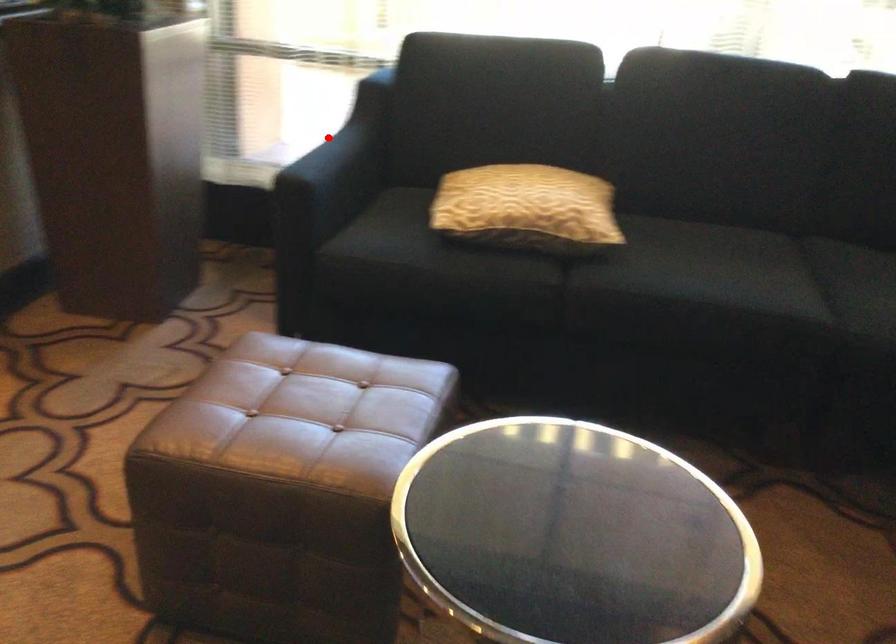
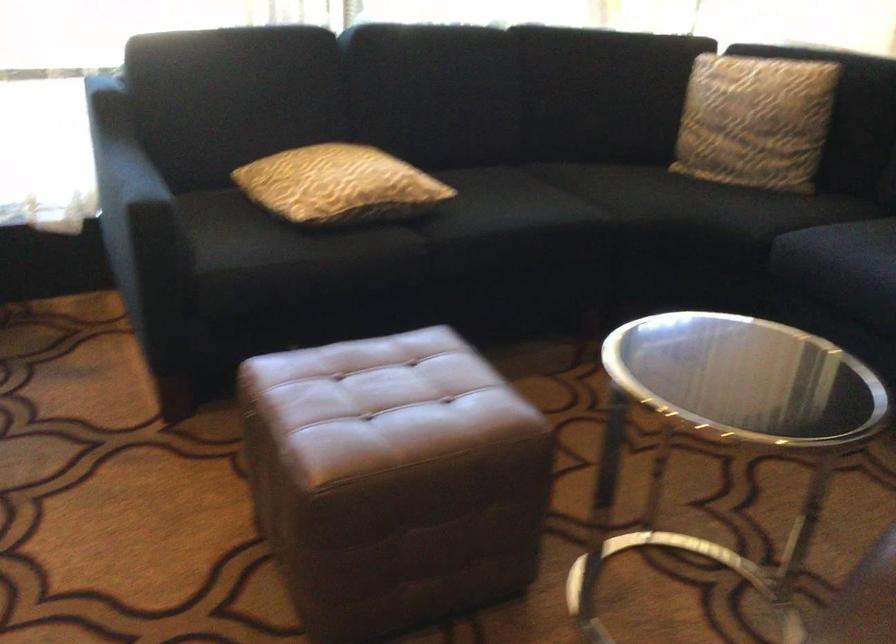
The point at the highlighted location is marked in the first image. Where is the corresponding point in the second image?

(118, 162)